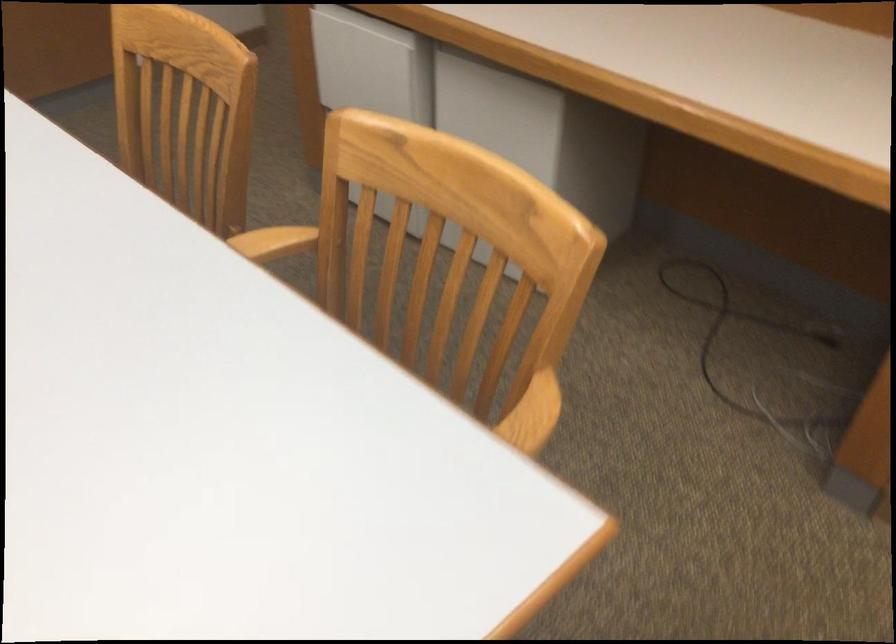
Locate an element on the screen. Image resolution: width=896 pixels, height=644 pixels. wooden chair armrest is located at coordinates (293, 241).